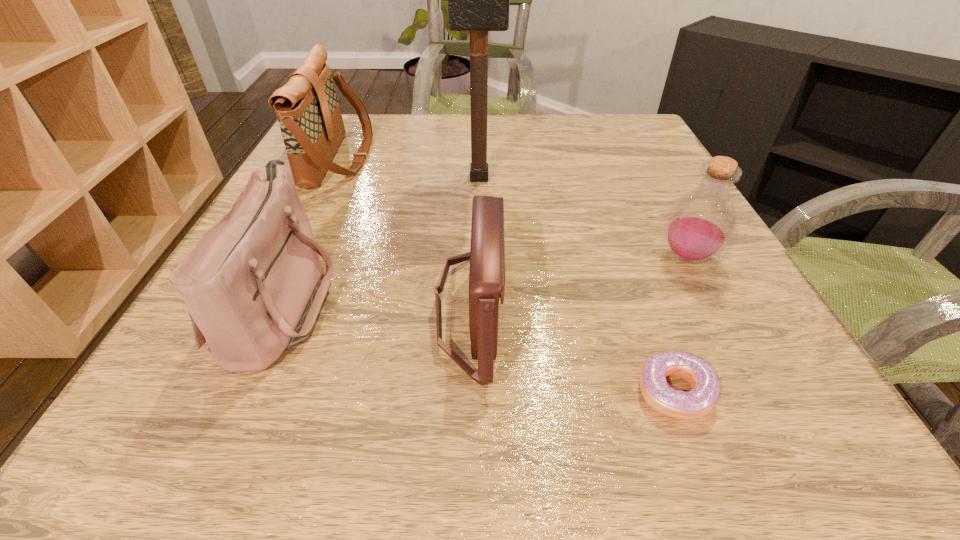
This screenshot has height=540, width=960. What are the coordinates of `object at the near right corner` in the screenshot? It's located at (698, 402).

In the image, there is a desktop. What are the coordinates of `blank space at the far edge` in the screenshot? It's located at (465, 138).

In the image, there is a desktop. Where is `vacant space at the near edge`? The width and height of the screenshot is (960, 540). vacant space at the near edge is located at coordinates (286, 429).

This screenshot has width=960, height=540. In order to click on vacant area at the left edge of the desktop in this screenshot , I will do `click(344, 192)`.

Where is `vacant space at the right edge of the desktop`? vacant space at the right edge of the desktop is located at coordinates (653, 187).

Find the location of a particular element. vacant position at the far left corner of the desktop is located at coordinates (356, 145).

This screenshot has width=960, height=540. I want to click on free region at the far right corner, so click(612, 133).

The height and width of the screenshot is (540, 960). I want to click on vacant space at the near right corner of the desktop, so click(x=738, y=393).

Locate an element on the screen. Image resolution: width=960 pixels, height=540 pixels. free point between the bottle and the shortest shoulder bag is located at coordinates (578, 282).

Where is `free spot between the bottle and the second object from right to left`? free spot between the bottle and the second object from right to left is located at coordinates (681, 324).